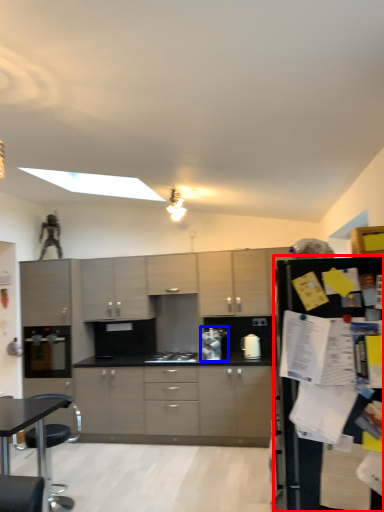
Question: Which object appears closest to the camera in this image, refrigerator (highlighted by a red box) or appliance (highlighted by a blue box)?

Choices:
 (A) refrigerator
 (B) appliance

Answer: (A)